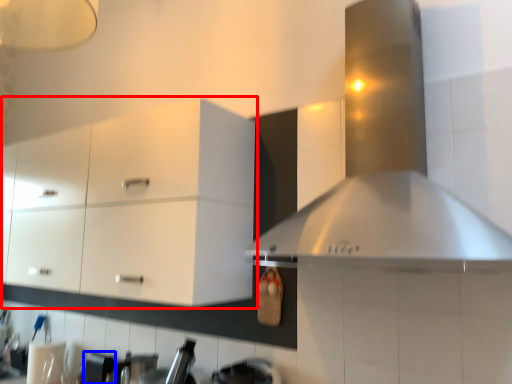
Question: Which of the following is the closest to the observer, cabinetry (highlighted by a red box) or appliance (highlighted by a blue box)?

Choices:
 (A) cabinetry
 (B) appliance

Answer: (A)